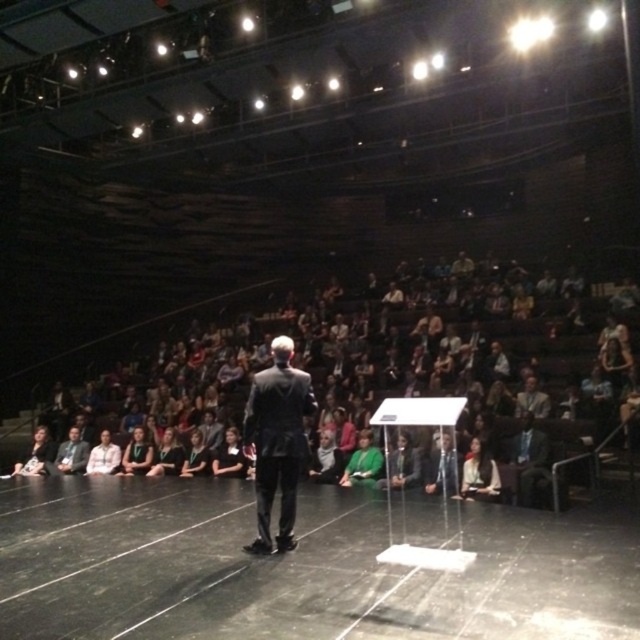
You are an event coordinator needing to place a 2.5 meter long banner between the black smooth stage at center and the green fabric at center. Based on the scene, will the banner fit without overlapping either object?

The distance between the black smooth stage at center and the green fabric at center is 3.02 meters. Since the banner is 2.5 meters long, it will fit between them without overlapping either object as there is enough space.

You are an event planner checking the stage setup for a presentation. You need to place a large screen on the stage. Which area would be more suitable for placing the screen without overcrowding the black smooth stage at center and the green fabric at center?

The green fabric at center would be more suitable for placing the screen since the black smooth stage at center occupies less space than the green fabric at center, providing more room for the screen.

Looking at this image, you are an attendee sitting in the audience and you see the black smooth stage at center and the white fabric shirt at lower center. Which object is positioned to the right when viewed from your perspective?

The black smooth stage at center is to the right of the white fabric shirt at lower center.